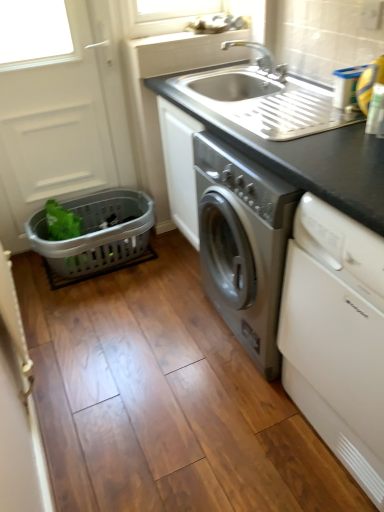
Describe the element at coordinates (97, 233) in the screenshot. The height and width of the screenshot is (512, 384). I see `gray plastic basket at lower left` at that location.

What do you see at coordinates (52, 130) in the screenshot?
I see `white matte screen door at left` at bounding box center [52, 130].

Find the location of a particular element. This screenshot has width=384, height=512. gray plastic basket at lower left is located at coordinates (97, 233).

Looking at this image, can you confirm if silver metallic faucet at upper center is smaller than green plastic basket at left?

Yes.

Considering the positions of objects silver metallic faucet at upper center and green plastic basket at left in the image provided, who is more to the left, silver metallic faucet at upper center or green plastic basket at left?

green plastic basket at left.

From the image's perspective, between silver metallic faucet at upper center and green plastic basket at left, which one is located above?

From the image's view, silver metallic faucet at upper center is above.

From a real-world perspective, does satin silver washing machine at center sit lower than white matte screen door at left?

Indeed, from a real-world perspective, satin silver washing machine at center is positioned beneath white matte screen door at left.

Consider the image. Considering the sizes of objects satin silver washing machine at center and white matte screen door at left in the image provided, who is wider, satin silver washing machine at center or white matte screen door at left?

satin silver washing machine at center is wider.

Would you say satin silver washing machine at center is outside white matte screen door at left?

Yes.

Is satin silver washing machine at center directly adjacent to white matte screen door at left?

satin silver washing machine at center and white matte screen door at left are clearly separated.

From the image's perspective, between gray plastic basket at lower left and white matte screen door at left, which one is located above?

white matte screen door at left, from the image's perspective.

Based on their positions, is gray plastic basket at lower left located to the left or right of white matte screen door at left?

gray plastic basket at lower left is to the right of white matte screen door at left.

Does gray plastic basket at lower left have a larger size compared to white matte screen door at left?

No, gray plastic basket at lower left is not bigger than white matte screen door at left.

Considering the relative sizes of gray plastic basket at lower left and white matte screen door at left in the image provided, is gray plastic basket at lower left wider than white matte screen door at left?

Correct, the width of gray plastic basket at lower left exceeds that of white matte screen door at left.

Does white glossy dishwasher at lower right have a lesser width compared to white matte screen door at left?

In fact, white glossy dishwasher at lower right might be wider than white matte screen door at left.

Do you think white glossy dishwasher at lower right is within white matte screen door at left, or outside of it?

white glossy dishwasher at lower right is located beyond the bounds of white matte screen door at left.

Considering the relative sizes of white glossy dishwasher at lower right and white matte screen door at left in the image provided, is white glossy dishwasher at lower right smaller than white matte screen door at left?

Incorrect, white glossy dishwasher at lower right is not smaller in size than white matte screen door at left.

Considering the relative sizes of black matte sink at upper center and white matte screen door at left in the image provided, is black matte sink at upper center bigger than white matte screen door at left?

No.

Which object is further away from the camera, black matte sink at upper center or white matte screen door at left?

white matte screen door at left.

How far apart are black matte sink at upper center and white matte screen door at left?

A distance of 29.19 inches exists between black matte sink at upper center and white matte screen door at left.

This screenshot has width=384, height=512. Find the location of `screen door above the black matte sink at upper center (from the image's perspective)`. screen door above the black matte sink at upper center (from the image's perspective) is located at coordinates (52, 130).

Is white matte screen door at left far from black matte sink at upper center?

They are positioned close to each other.

Which is nearer, (112,156) or (202,114)?

Point (112,156).

Can you tell me how much white matte screen door at left and black matte sink at upper center differ in facing direction?

89 degrees.

Consider the image. Considering the sizes of objects white glossy dishwasher at lower right and black matte sink at upper center in the image provided, who is smaller, white glossy dishwasher at lower right or black matte sink at upper center?

Smaller between the two is black matte sink at upper center.

Which of these two, white glossy dishwasher at lower right or black matte sink at upper center, is wider?

With larger width is white glossy dishwasher at lower right.

You are a GUI agent. You are given a task and a screenshot of the screen. Output one action in this format:
    pyautogui.click(x=<x>, y=<y>)
    Task: Click on the countertop that is behind the white glossy dishwasher at lower right
    The width and height of the screenshot is (384, 512).
    Given the screenshot: What is the action you would take?
    pyautogui.click(x=292, y=138)

Is white glossy dishwasher at lower right to the left or to the right of black matte sink at upper center in the image?

Clearly, white glossy dishwasher at lower right is on the right of black matte sink at upper center in the image.

This screenshot has width=384, height=512. In order to click on tap in front of the green plastic basket at left in this screenshot , I will do `click(260, 57)`.

What are the coordinates of `appliance that appears below the white matte screen door at left (from a real-world perspective)` in the screenshot? It's located at (294, 138).

Which object lies nearer to the anchor point silver metallic faucet at upper center, black matte sink at upper center or white matte screen door at left?

black matte sink at upper center is closer to silver metallic faucet at upper center.

When comparing their distances from green plastic basket at left, does silver metallic faucet at upper center or satin silver washing machine at center seem closer?

Among the two, satin silver washing machine at center is located nearer to green plastic basket at left.

When comparing their distances from black matte sink at upper center, does green plastic basket at left or white matte screen door at left seem closer?

white matte screen door at left is positioned closer to the anchor black matte sink at upper center.

Estimate the real-world distances between objects in this image. Which object is closer to satin silver washing machine at center, gray plastic basket at lower left or green plastic basket at left?

Among the two, gray plastic basket at lower left is located nearer to satin silver washing machine at center.

Considering their positions, is white glossy dishwasher at lower right positioned closer to silver metallic faucet at upper center than gray plastic basket at lower left?

gray plastic basket at lower left lies closer to silver metallic faucet at upper center than the other object.

From the image, which object appears to be farther from white matte screen door at left, silver metallic faucet at upper center or satin silver washing machine at center?

silver metallic faucet at upper center.

Looking at the image, which one is located closer to black matte sink at upper center, gray plastic basket at lower left or silver metallic faucet at upper center?

silver metallic faucet at upper center is closer to black matte sink at upper center.

Estimate the real-world distances between objects in this image. Which object is closer to green plastic basket at left, black matte sink at upper center or silver metallic faucet at upper center?

black matte sink at upper center lies closer to green plastic basket at left than the other object.

I want to click on countertop between white matte screen door at left and satin silver washing machine at center from left to right, so click(292, 138).

Locate an element on the screen. Image resolution: width=384 pixels, height=512 pixels. tap between green plastic basket at left and satin silver washing machine at center from left to right is located at coordinates (260, 57).

Identify the location of countertop between white glossy dishwasher at lower right and gray plastic basket at lower left in the front-back direction. (292, 138).

Locate an element on the screen. The image size is (384, 512). countertop between green plastic basket at left and silver metallic faucet at upper center in the horizontal direction is located at coordinates (292, 138).